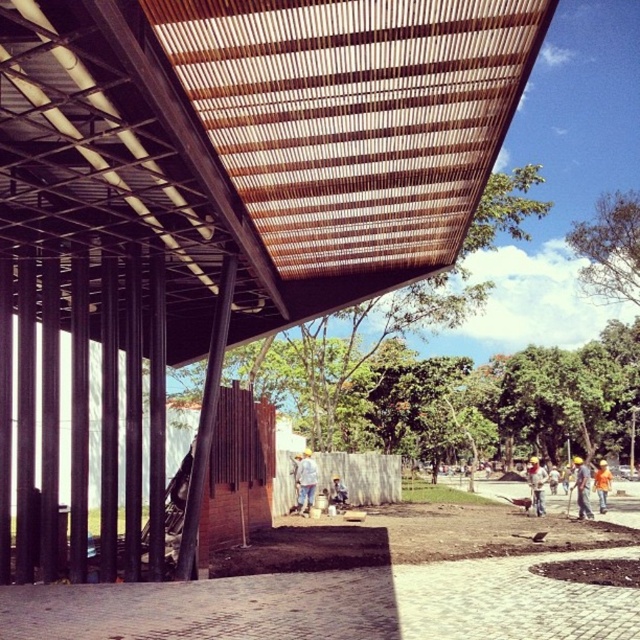
You are a drone operator trying to capture a photo of the construction site. Your drone is currently at the center of the image. The white fabric shirt at center is an important subject. To ensure the shirt is in the frame, in which direction should you move the drone? Please respond with a direction like north, south, east, or west.

The white fabric shirt at center is located at point (305, 481). Since the drone is at the center of the image, which is point (320, 320), the shirt is to the northeast of the drone. Therefore, you should move the drone northeast to center the shirt in the frame.

You are a safety inspector at the construction site. You notice two workers wearing a white fabric shirt at center and blue denim jeans at center. Which clothing item is positioned higher on their body?

The white fabric shirt at center is much taller as the blue denim jeans at center, so the white fabric shirt at center is positioned higher on their body.